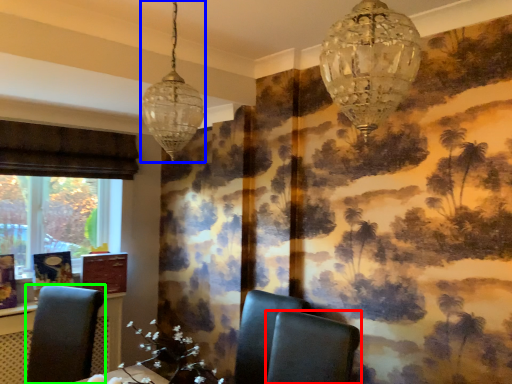
Question: Based on their relative distances, which object is farther from chair (highlighted by a red box)? Choose from lamp (highlighted by a blue box) and chair (highlighted by a green box).

Choices:
 (A) lamp
 (B) chair

Answer: (B)